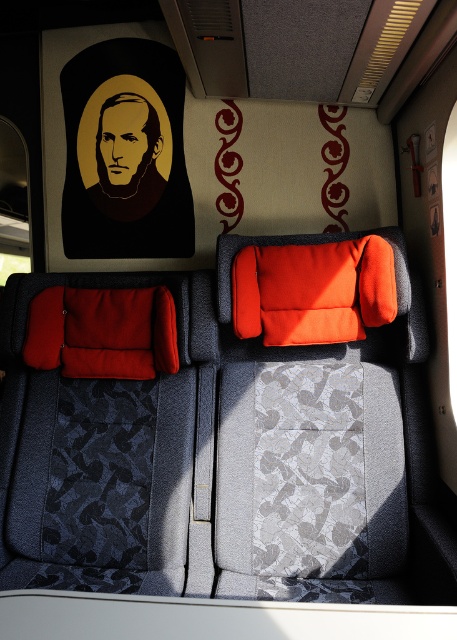
You are a traveler with a backpack that has a width of 16 inches. You want to place your backpack between the orange fabric pillow at center and the velvet red pillow at left. Can you fit your backpack in that space?

The distance between the orange fabric pillow at center and the velvet red pillow at left is 17.22 inches, so yes, the backpack can fit as it is narrower than the available space.

You are designing a virtual tour of the train compartment and need to place a digital marker exactly at the center of the orange fabric pillow at center. According to the coordinate system where the bottom left corner of the image is the origin point, what are the coordinates where you should place the marker?

The coordinates for the center of the orange fabric pillow at center are at point (313, 291).

You are a passenger sitting in the train compartment and want to place a book on the seat. Which pillow, the orange fabric pillow at center or the velvet red pillow at left, would provide a taller surface to place your book?

The orange fabric pillow at center is much taller than the velvet red pillow at left, so placing the book on the orange fabric pillow at center would provide a taller surface.